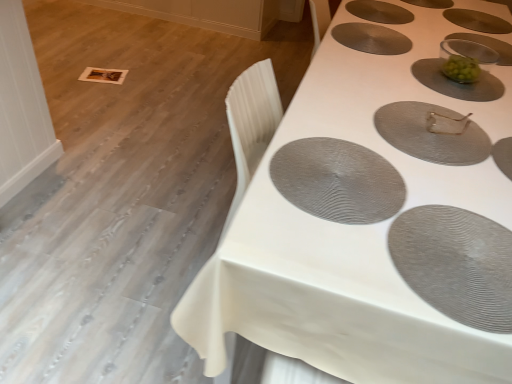
The height and width of the screenshot is (384, 512). I want to click on matte gray placemat at upper right, which is the 7th oval from front to back, so click(x=477, y=21).

You are a GUI agent. You are given a task and a screenshot of the screen. Output one action in this format:
    pyautogui.click(x=<x>, y=<y>)
    Task: Click on the clear glass bowl at upper right
    Image resolution: width=512 pixels, height=384 pixels.
    Given the screenshot: What is the action you would take?
    pyautogui.click(x=465, y=60)

Where is `matte gray placemat at upper center, which is the sixth oval in front-to-back order`? The width and height of the screenshot is (512, 384). matte gray placemat at upper center, which is the sixth oval in front-to-back order is located at coordinates (379, 12).

From their relative heights in the image, would you say matte gray placemat at upper right, which is the 7th oval from front to back, is taller or shorter than white textured table at upper right?

In the image, matte gray placemat at upper right, which is the 7th oval from front to back, appears to be shorter than white textured table at upper right.

Is matte gray placemat at upper right, which is the 7th oval from front to back, positioned behind white textured table at upper right?

Yes, matte gray placemat at upper right, which is the 7th oval from front to back, is further from the viewer.

Considering the sizes of objects matte gray placemat at upper right, which is the 7th oval from front to back, and white textured table at upper right in the image provided, who is bigger, matte gray placemat at upper right, which is the 7th oval from front to back, or white textured table at upper right?

white textured table at upper right is bigger.

Which is behind, point (490, 81) or point (479, 157)?

The point (490, 81) is more distant.

From the image's perspective, which is above, green matte bowl at upper right, which is the fourth oval from back to front, or matte gray placemat at center, placed as the third oval when sorted from front to back?

green matte bowl at upper right, which is the fourth oval from back to front.

In the scene shown: Does green matte bowl at upper right, which is the fourth oval from back to front, lie in front of matte gray placemat at center, placed as the third oval when sorted from front to back?

No.

In the scene shown: Does textured gray oval at center, placed as the second oval when sorted from front to back, have a lesser width compared to matte gray placemat at upper right, which is the 7th oval from front to back?

No.

From a real-world perspective, is textured gray oval at center, placed as the second oval when sorted from front to back, physically located above or below matte gray placemat at upper right, which is the 7th oval from front to back?

In terms of real-world spatial position, textured gray oval at center, placed as the second oval when sorted from front to back, is above matte gray placemat at upper right, which is the 7th oval from front to back.

Is textured gray oval at center, the 6th oval in the back-to-front sequence, to the right of matte gray placemat at upper right, which is the 7th oval from front to back, from the viewer's perspective?

In fact, textured gray oval at center, the 6th oval in the back-to-front sequence, is to the left of matte gray placemat at upper right, which is the 7th oval from front to back.

Which of these two, gray textured placemat at lower right, the first oval from the front, or matte gray placemat at center, which is the fifth oval in back-to-front order, stands taller?

matte gray placemat at center, which is the fifth oval in back-to-front order, is taller.

Which object is wider, gray textured placemat at lower right, the first oval from the front, or matte gray placemat at center, placed as the third oval when sorted from front to back?

matte gray placemat at center, placed as the third oval when sorted from front to back.

Which is behind, point (406, 258) or point (457, 144)?

The point (457, 144) is behind.

Is gray textured placemat at lower right, the first oval from the front, positioned with its back to matte gray placemat at center, which is the fifth oval in back-to-front order?

That's right, gray textured placemat at lower right, the first oval from the front, is facing away from matte gray placemat at center, which is the fifth oval in back-to-front order.

Does matte gray placemat at upper center, positioned as the fifth oval in front-to-back order, have a larger size compared to clear glass bowl at upper right?

Actually, matte gray placemat at upper center, positioned as the fifth oval in front-to-back order, might be smaller than clear glass bowl at upper right.

Could you tell me if matte gray placemat at upper center, arranged as the third oval when viewed from the back, is facing clear glass bowl at upper right?

No, matte gray placemat at upper center, arranged as the third oval when viewed from the back, is not oriented towards clear glass bowl at upper right.

Consider the image. Which of these two, matte gray placemat at upper center, positioned as the fifth oval in front-to-back order, or clear glass bowl at upper right, stands taller?

With more height is clear glass bowl at upper right.

How many degrees apart are the facing directions of matte gray placemat at upper center, arranged as the third oval when viewed from the back, and clear glass bowl at upper right?

matte gray placemat at upper center, arranged as the third oval when viewed from the back, and clear glass bowl at upper right are facing 4.28 degrees away from each other.

Which of these two, matte gray placemat at center, which is the fifth oval in back-to-front order, or textured gray oval at center, the 6th oval in the back-to-front sequence, stands taller?

With more height is textured gray oval at center, the 6th oval in the back-to-front sequence.

Is matte gray placemat at center, placed as the third oval when sorted from front to back, inside or outside of textured gray oval at center, the 6th oval in the back-to-front sequence?

The correct answer is: outside.

Is point (448, 149) behind point (393, 176)?

Yes, point (448, 149) is behind point (393, 176).

In the scene shown: From the image's perspective, is matte gray placemat at center, placed as the third oval when sorted from front to back, positioned above or below textured gray oval at center, placed as the second oval when sorted from front to back?

matte gray placemat at center, placed as the third oval when sorted from front to back, is above textured gray oval at center, placed as the second oval when sorted from front to back.

Is clear glass bowl at upper right at the back of matte gray placemat at upper right, which is the 7th oval from front to back?

No, matte gray placemat at upper right, which is the 7th oval from front to back,'s orientation is not away from clear glass bowl at upper right.

Is clear glass bowl at upper right located within matte gray placemat at upper right, which is the 7th oval from front to back?

Actually, clear glass bowl at upper right is outside matte gray placemat at upper right, which is the 7th oval from front to back.

Looking at this image, how many degrees apart are the facing directions of matte gray placemat at upper right, which is the first oval from back to front, and clear glass bowl at upper right?

173 degrees.

Is matte gray placemat at upper right, which is the 7th oval from front to back, wider than clear glass bowl at upper right?

Yes.

The height and width of the screenshot is (384, 512). There is a white textured table at upper right. In order to click on the 3rd oval above it (from the image's perspective) in this screenshot , I will do `click(477, 21)`.

Where is `the 1st oval below when counting from the green matte bowl at upper right, the 4th oval from the front (from the image's perspective)`? the 1st oval below when counting from the green matte bowl at upper right, the 4th oval from the front (from the image's perspective) is located at coordinates coord(432,133).

Based on the photo, estimate the real-world distances between objects in this image. Which object is closer to clear glass bowl at upper right, matte gray placemat at upper right, which is the 7th oval from front to back, or textured gray oval at center, placed as the second oval when sorted from front to back?

matte gray placemat at upper right, which is the 7th oval from front to back, is closer to clear glass bowl at upper right.

From the image, which object appears to be farther from green matte bowl at upper right, the 4th oval from the front, gray textured placemat at lower right, the first oval from the front, or matte gray placemat at upper center, acting as the second oval starting from the back?

gray textured placemat at lower right, the first oval from the front, lies further to green matte bowl at upper right, the 4th oval from the front, than the other object.

Considering their positions, is white textured table at upper right positioned closer to matte gray placemat at upper center, acting as the second oval starting from the back, than matte gray placemat at upper right, which is the first oval from back to front?

matte gray placemat at upper right, which is the first oval from back to front, is closer to matte gray placemat at upper center, acting as the second oval starting from the back.

Looking at the image, which one is located closer to matte gray placemat at center, which is the fifth oval in back-to-front order, green matte bowl at upper right, the 4th oval from the front, or white textured table at upper right?

green matte bowl at upper right, the 4th oval from the front.

Looking at this image, based on their spatial positions, is matte gray placemat at upper right, which is the 7th oval from front to back, or clear glass bowl at upper right closer to matte gray placemat at upper center, arranged as the third oval when viewed from the back?

clear glass bowl at upper right is closer to matte gray placemat at upper center, arranged as the third oval when viewed from the back.

Based on their spatial positions, is green matte bowl at upper right, which is the fourth oval from back to front, or textured gray oval at center, placed as the second oval when sorted from front to back, closer to clear glass bowl at upper right?

Among the two, green matte bowl at upper right, which is the fourth oval from back to front, is located nearer to clear glass bowl at upper right.

When comparing their distances from gray textured placemat at lower right, arranged as the seventh oval when viewed from the back, does clear glass bowl at upper right or textured gray oval at center, the 6th oval in the back-to-front sequence, seem further?

clear glass bowl at upper right lies further to gray textured placemat at lower right, arranged as the seventh oval when viewed from the back, than the other object.

When comparing their distances from white textured table at upper right, does matte gray placemat at upper right, which is the first oval from back to front, or matte gray placemat at center, placed as the third oval when sorted from front to back, seem further?

The object further to white textured table at upper right is matte gray placemat at upper right, which is the first oval from back to front.

I want to click on oval between green matte bowl at upper right, the 4th oval from the front, and matte gray placemat at upper center, acting as the second oval starting from the back, from front to back, so click(x=371, y=38).

You are a GUI agent. You are given a task and a screenshot of the screen. Output one action in this format:
    pyautogui.click(x=<x>, y=<y>)
    Task: Click on the appliance between gray textured placemat at lower right, the first oval from the front, and matte gray placemat at upper right, which is the 7th oval from front to back, in the front-back direction
    The width and height of the screenshot is (512, 384).
    Given the screenshot: What is the action you would take?
    pyautogui.click(x=465, y=60)

The height and width of the screenshot is (384, 512). Identify the location of appliance positioned between green matte bowl at upper right, the 4th oval from the front, and matte gray placemat at upper right, which is the first oval from back to front, from near to far. (465, 60).

What are the coordinates of `appliance between textured gray oval at center, the 6th oval in the back-to-front sequence, and matte gray placemat at upper center, positioned as the fifth oval in front-to-back order, in the front-back direction` in the screenshot? It's located at (465, 60).